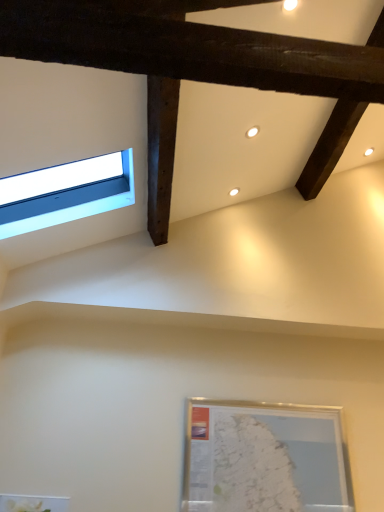
Question: Is silver metallic picture frame at lower right surrounded by blue glass window at upper left?

Choices:
 (A) yes
 (B) no

Answer: (B)

Question: From a real-world perspective, is blue glass window at upper left over silver metallic picture frame at lower right?

Choices:
 (A) no
 (B) yes

Answer: (B)

Question: Does blue glass window at upper left have a greater height compared to silver metallic picture frame at lower right?

Choices:
 (A) no
 (B) yes

Answer: (A)

Question: Is blue glass window at upper left turned away from silver metallic picture frame at lower right?

Choices:
 (A) no
 (B) yes

Answer: (A)

Question: Does blue glass window at upper left appear on the left side of silver metallic picture frame at lower right?

Choices:
 (A) yes
 (B) no

Answer: (A)

Question: Could you tell me if blue glass window at upper left is turned towards silver metallic picture frame at lower right?

Choices:
 (A) yes
 (B) no

Answer: (B)

Question: From a real-world perspective, does silver metallic picture frame at lower right stand above blue glass window at upper left?

Choices:
 (A) yes
 (B) no

Answer: (B)

Question: Would you say silver metallic picture frame at lower right is outside blue glass window at upper left?

Choices:
 (A) yes
 (B) no

Answer: (A)

Question: Considering the relative sizes of silver metallic picture frame at lower right and blue glass window at upper left in the image provided, is silver metallic picture frame at lower right smaller than blue glass window at upper left?

Choices:
 (A) yes
 (B) no

Answer: (A)

Question: Is silver metallic picture frame at lower right facing away from blue glass window at upper left?

Choices:
 (A) no
 (B) yes

Answer: (A)

Question: Is silver metallic picture frame at lower right not near blue glass window at upper left?

Choices:
 (A) no
 (B) yes

Answer: (B)

Question: Is silver metallic picture frame at lower right surrounding blue glass window at upper left?

Choices:
 (A) no
 (B) yes

Answer: (A)

Question: From a real-world perspective, is blue glass window at upper left physically located above or below silver metallic picture frame at lower right?

Choices:
 (A) below
 (B) above

Answer: (B)